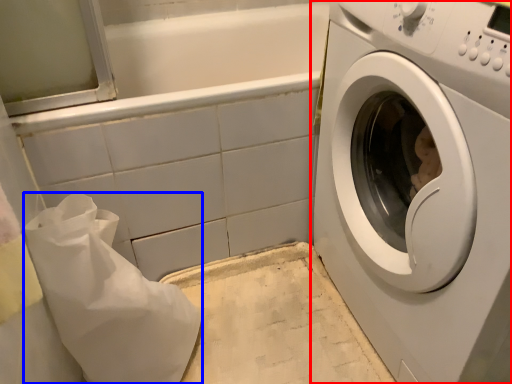
Question: Which object is further to the camera taking this photo, washing machine (highlighted by a red box) or material (highlighted by a blue box)?

Choices:
 (A) washing machine
 (B) material

Answer: (B)